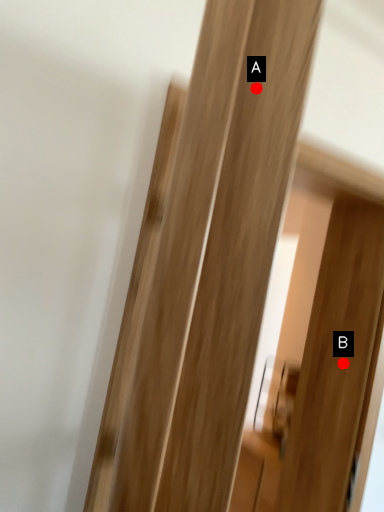
Question: Two points are circled on the image, labeled by A and B beside each circle. Which point is farther to the camera?

Choices:
 (A) A is further
 (B) B is further

Answer: (B)